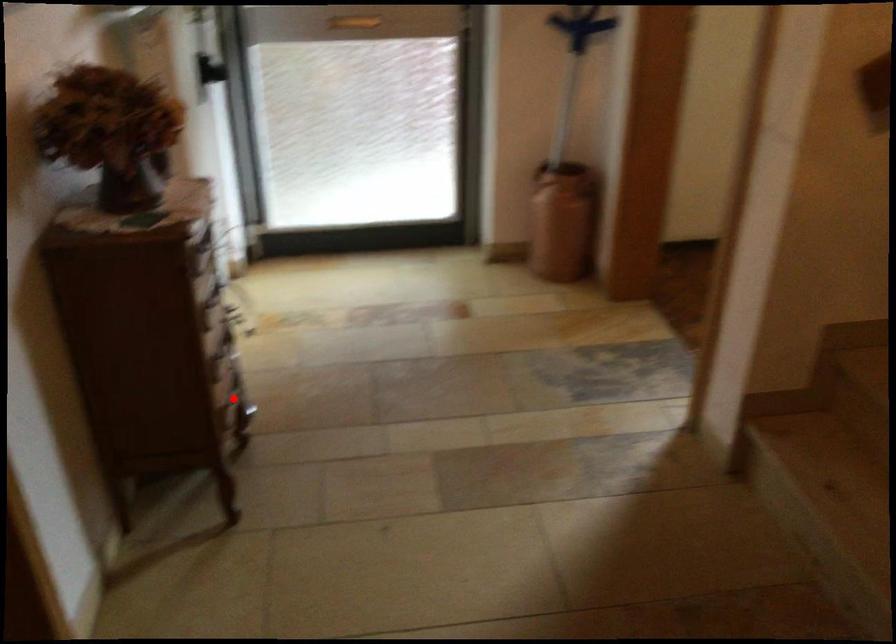
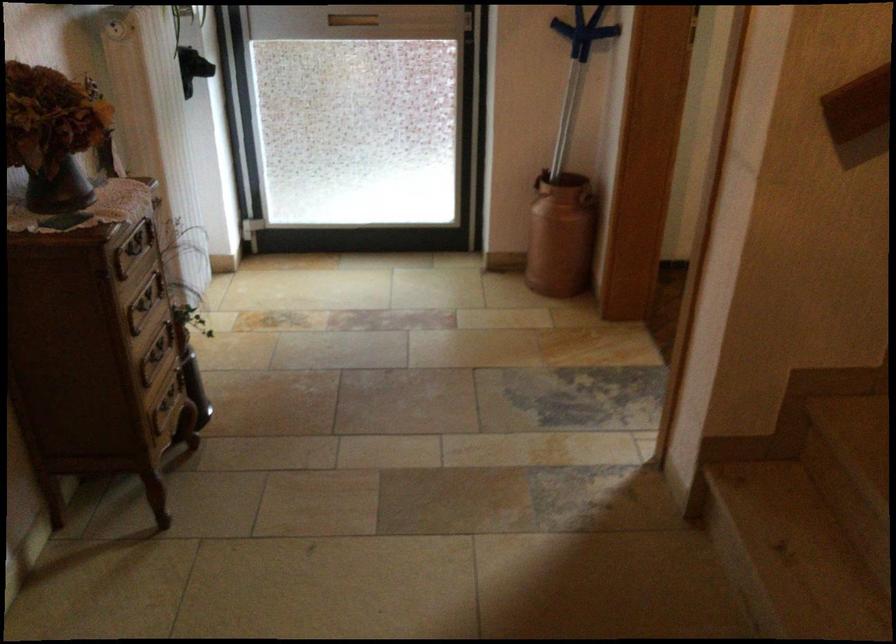
In the second image, find the point that corresponds to the highlighted location in the first image.

(167, 404)